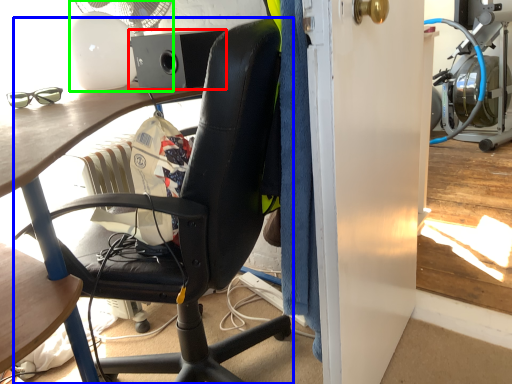
Question: Estimate the real-world distances between objects in this image. Which object is farther from loudspeaker (highlighted by a red box), chair (highlighted by a blue box) or mechanical fan (highlighted by a green box)?

Choices:
 (A) chair
 (B) mechanical fan

Answer: (A)